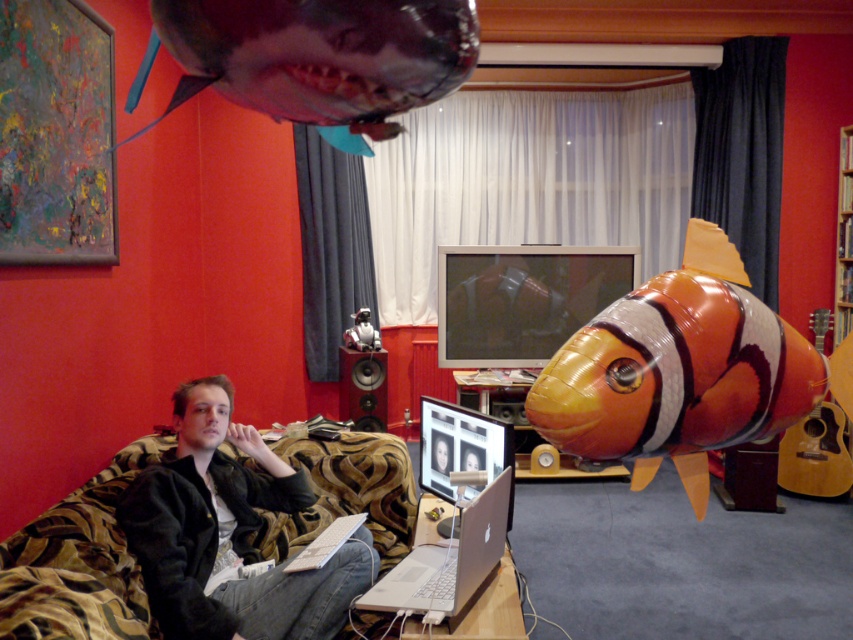
Question: Which point appears farthest from the camera in this image?

Choices:
 (A) (350, 406)
 (B) (444, 570)
 (C) (346, 70)

Answer: (A)

Question: Considering the relative positions of black leather jacket at lower left and shiny metallic shark at upper center in the image provided, where is black leather jacket at lower left located with respect to shiny metallic shark at upper center?

Choices:
 (A) right
 (B) left

Answer: (B)

Question: Among these points, which one is nearest to the camera?

Choices:
 (A) (178, 451)
 (B) (271, 33)
 (C) (849, 420)

Answer: (B)

Question: Observing the image, what is the correct spatial positioning of shiny metallic shark at upper center in reference to silver metallic laptop at center?

Choices:
 (A) below
 (B) above

Answer: (B)

Question: Which of the following is the farthest from the observer?

Choices:
 (A) wooden at right
 (B) silver metallic laptop at center

Answer: (A)

Question: Is black leather jacket at lower left to the right of wooden at right from the viewer's perspective?

Choices:
 (A) no
 (B) yes

Answer: (A)